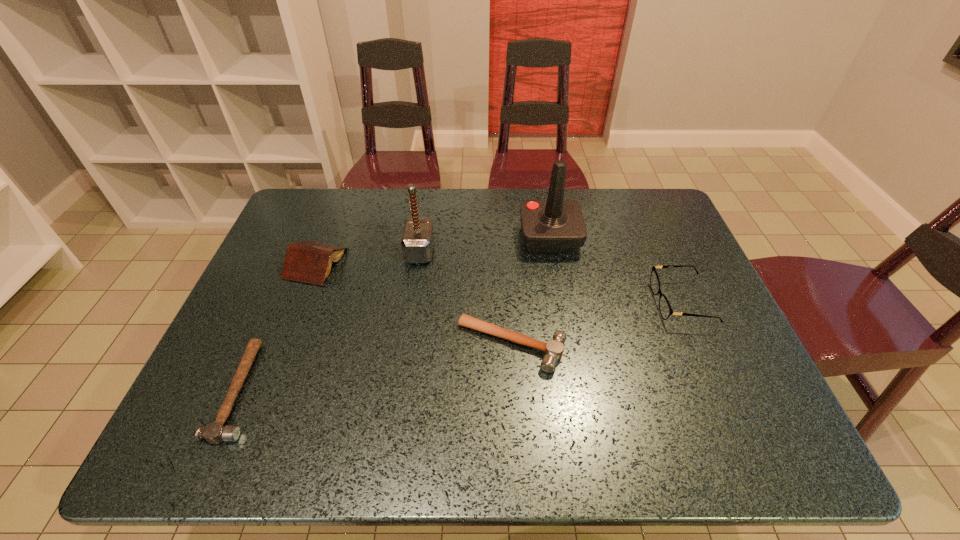
What are the coordinates of `free space between the rightmost object and the fourth object from right to left` in the screenshot? It's located at (551, 277).

You are a GUI agent. You are given a task and a screenshot of the screen. Output one action in this format:
    pyautogui.click(x=<x>, y=<y>)
    Task: Click on the vacant space that is in between the rightmost object and the rightmost hammer
    
    Given the screenshot: What is the action you would take?
    pyautogui.click(x=596, y=323)

At what (x,y) coordinates should I click in order to perform the action: click on free space between the joystick and the second hammer from right to left. Please return your answer as a coordinate pair (x, y). Image resolution: width=960 pixels, height=540 pixels. Looking at the image, I should click on (485, 244).

The height and width of the screenshot is (540, 960). Identify the location of free point between the book and the spectacles. (499, 282).

Where is `free spot between the joystick and the rightmost hammer`? This screenshot has height=540, width=960. free spot between the joystick and the rightmost hammer is located at coordinates (531, 291).

The height and width of the screenshot is (540, 960). I want to click on free spot between the rightmost object and the joystick, so click(615, 269).

Find the location of a particular element. vacant space that's between the book and the third object from left to right is located at coordinates (368, 257).

Identify which object is the second nearest to the rightmost hammer. Please provide its 2D coordinates. Your answer should be formatted as a tuple, i.e. [(x, y)], where the tuple contains the x and y coordinates of a point satisfying the conditions above.

[(554, 225)]

Where is `object that is the third nearest to the leftmost hammer`? object that is the third nearest to the leftmost hammer is located at coordinates (553, 349).

Where is `hammer that is the closest one to the shortest object`? The width and height of the screenshot is (960, 540). hammer that is the closest one to the shortest object is located at coordinates (417, 240).